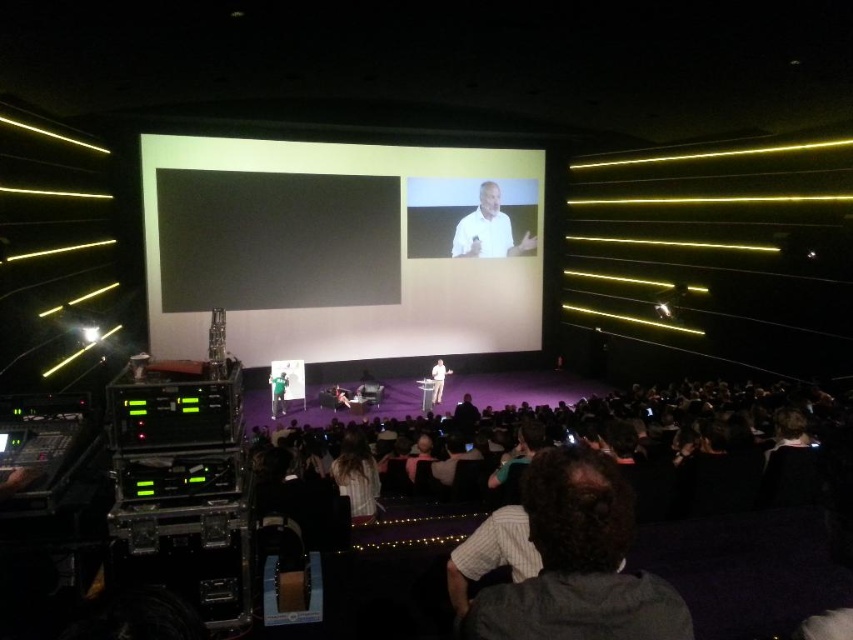
Is white matte projection screen at center behind white matte shirt at upper center?

No, white matte projection screen at center is closer to the viewer.

Who is more distant from viewer, (373, 192) or (483, 243)?

The point (483, 243) is behind.

The width and height of the screenshot is (853, 640). In order to click on white matte projection screen at center in this screenshot , I will do `click(341, 248)`.

Measure the distance between white matte projection screen at center and camera.

A distance of 13.83 meters exists between white matte projection screen at center and camera.

Is white matte projection screen at center bigger than dark brown hair at center?

Yes.

Does point (457, 160) come behind point (606, 518)?

That is True.

This screenshot has width=853, height=640. What are the coordinates of `white matte projection screen at center` in the screenshot? It's located at coord(341,248).

Does point (645, 627) lie behind point (505, 232)?

No.

In order to click on dark brown hair at center in this screenshot , I will do `click(578, 563)`.